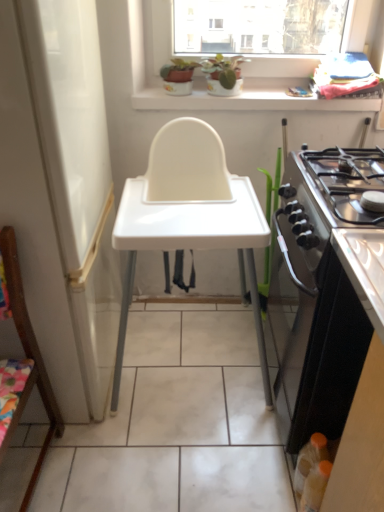
Describe the element at coordinates (309, 460) in the screenshot. I see `translucent plastic bottle at lower right` at that location.

What do you see at coordinates (348, 180) in the screenshot?
I see `stainless steel gas stove at right` at bounding box center [348, 180].

What do you see at coordinates (323, 289) in the screenshot? Image resolution: width=384 pixels, height=512 pixels. I see `black glossy oven at right` at bounding box center [323, 289].

Where is `white plastic changing table at center`? white plastic changing table at center is located at coordinates (190, 245).

You are a GUI agent. You are given a task and a screenshot of the screen. Output one action in this format:
    pyautogui.click(x=<x>, y=<y>)
    Task: Click on the translucent plastic bottle at lower right
    The image size is (384, 512).
    Given the screenshot: What is the action you would take?
    pyautogui.click(x=309, y=460)

Considering the relative sizes of wooden chair at left and white glossy screen door at center in the image provided, is wooden chair at left smaller than white glossy screen door at center?

Correct, wooden chair at left occupies less space than white glossy screen door at center.

From a real-world perspective, which is physically above, wooden chair at left or white glossy screen door at center?

In real-world perspective, white glossy screen door at center is above.

Is wooden chair at left further to camera compared to white glossy screen door at center?

No, wooden chair at left is closer to the camera.

Would you say wooden chair at left is inside or outside white glossy screen door at center?

wooden chair at left is located beyond the bounds of white glossy screen door at center.

Which object is positioned more to the left, black glossy oven at right or stainless steel gas stove at right?

From the viewer's perspective, black glossy oven at right appears more on the left side.

Is black glossy oven at right inside or outside of stainless steel gas stove at right?

black glossy oven at right is not inside stainless steel gas stove at right, it's outside.

How many degrees apart are the facing directions of black glossy oven at right and stainless steel gas stove at right?

There is a 90-degree angle between the facing directions of black glossy oven at right and stainless steel gas stove at right.

Is black glossy oven at right wider or thinner than stainless steel gas stove at right?

In the image, black glossy oven at right appears to be wider than stainless steel gas stove at right.

This screenshot has width=384, height=512. I want to click on gas stove lying below the white glossy window sill at upper center (from the image's perspective), so click(348, 180).

Is the position of stainless steel gas stove at right more distant than that of white glossy window sill at upper center?

No, stainless steel gas stove at right is closer to the camera.

Is stainless steel gas stove at right inside or outside of white glossy window sill at upper center?

stainless steel gas stove at right is located beyond the bounds of white glossy window sill at upper center.

From a real-world perspective, between stainless steel gas stove at right and white glossy window sill at upper center, who is vertically higher?

white glossy window sill at upper center is physically above.

Is white glossy screen door at center to the right of black glossy oven at right from the viewer's perspective?

Incorrect, white glossy screen door at center is not on the right side of black glossy oven at right.

From a real-world perspective, is white glossy screen door at center physically located above or below black glossy oven at right?

Clearly, from a real-world perspective, white glossy screen door at center is above black glossy oven at right.

From the image's perspective, is white glossy screen door at center positioned above or below black glossy oven at right?

From the image's perspective, white glossy screen door at center appears above black glossy oven at right.

Is white plastic changing table at center inside or outside of white glossy screen door at center?

white plastic changing table at center cannot be found inside white glossy screen door at center.

In terms of width, does white plastic changing table at center look wider or thinner when compared to white glossy screen door at center?

In the image, white plastic changing table at center appears to be wider than white glossy screen door at center.

From the image's perspective, is white plastic changing table at center below white glossy screen door at center?

Yes, from the image's perspective, white plastic changing table at center is beneath white glossy screen door at center.

The width and height of the screenshot is (384, 512). Find the location of `screen door lying above the white plastic changing table at center (from the image's perspective)`. screen door lying above the white plastic changing table at center (from the image's perspective) is located at coordinates (77, 175).

Looking at their sizes, would you say white glossy window sill at upper center is wider or thinner than black glossy oven at right?

white glossy window sill at upper center is thinner than black glossy oven at right.

From the image's perspective, would you say white glossy window sill at upper center is positioned over black glossy oven at right?

Yes.

In the scene shown: Which is more to the left, white glossy window sill at upper center or black glossy oven at right?

From the viewer's perspective, white glossy window sill at upper center appears more on the left side.

Can you see white glossy window sill at upper center touching black glossy oven at right?

There is a gap between white glossy window sill at upper center and black glossy oven at right.

Is translucent plastic bottle at lower right aimed at stainless steel gas stove at right?

No, translucent plastic bottle at lower right is not oriented towards stainless steel gas stove at right.

Is translucent plastic bottle at lower right not close to stainless steel gas stove at right?

No, translucent plastic bottle at lower right is in close proximity to stainless steel gas stove at right.

Considering the positions of objects translucent plastic bottle at lower right and stainless steel gas stove at right in the image provided, who is more to the left, translucent plastic bottle at lower right or stainless steel gas stove at right?

Positioned to the left is translucent plastic bottle at lower right.

Locate an element on the screen. The height and width of the screenshot is (512, 384). chair beneath the white glossy screen door at center (from a real-world perspective) is located at coordinates (26, 360).

You are a GUI agent. You are given a task and a screenshot of the screen. Output one action in this format:
    pyautogui.click(x=<x>, y=<y>)
    Task: Click on the cabinetry on the left of stainless steel gas stove at right
    The image size is (384, 512).
    Given the screenshot: What is the action you would take?
    pyautogui.click(x=323, y=289)

Which object lies further to the anchor point wooden chair at left, white glossy window sill at upper center or stainless steel gas stove at right?

white glossy window sill at upper center lies further to wooden chair at left than the other object.

Estimate the real-world distances between objects in this image. Which object is closer to white glossy window sill at upper center, black glossy oven at right or translucent plastic bottle at lower right?

Among the two, black glossy oven at right is located nearer to white glossy window sill at upper center.

Which object lies nearer to the anchor point white plastic changing table at center, white glossy screen door at center or white glossy window sill at upper center?

white glossy screen door at center.

From the image, which object appears to be nearer to translucent plastic bottle at lower right, white glossy screen door at center or stainless steel gas stove at right?

stainless steel gas stove at right is positioned closer to the anchor translucent plastic bottle at lower right.

Looking at this image, looking at the image, which one is located closer to white glossy window sill at upper center, translucent plastic bottle at lower right or white glossy screen door at center?

white glossy screen door at center.

Which object lies nearer to the anchor point stainless steel gas stove at right, white glossy screen door at center or white plastic changing table at center?

white plastic changing table at center.

From the image, which object appears to be nearer to wooden chair at left, white plastic changing table at center or black glossy oven at right?

Among the two, white plastic changing table at center is located nearer to wooden chair at left.

Estimate the real-world distances between objects in this image. Which object is closer to white glossy screen door at center, white glossy window sill at upper center or black glossy oven at right?

white glossy window sill at upper center.

Find the location of a particular element. chair between white glossy screen door at center and black glossy oven at right from left to right is located at coordinates (26, 360).

The width and height of the screenshot is (384, 512). What are the coordinates of `cabinetry between white glossy window sill at upper center and translucent plastic bottle at lower right vertically` in the screenshot? It's located at (323, 289).

Identify the location of changing table that lies between stainless steel gas stove at right and translucent plastic bottle at lower right from top to bottom. The image size is (384, 512). (190, 245).

At what (x,y) coordinates should I click in order to perform the action: click on window sill located between white glossy screen door at center and black glossy oven at right in the left-right direction. Please return your answer as a coordinate pair (x, y). The image size is (384, 512). Looking at the image, I should click on (250, 100).